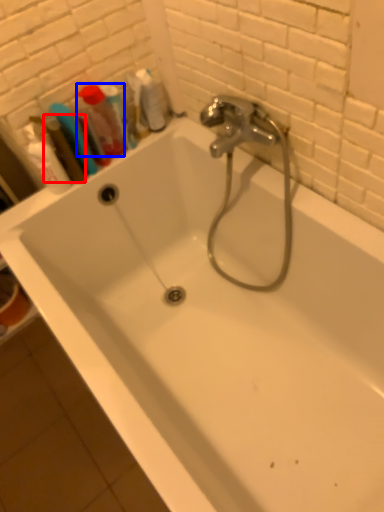
Question: Which object appears farthest to the camera in this image, mouthwash (highlighted by a red box) or mouthwash (highlighted by a blue box)?

Choices:
 (A) mouthwash
 (B) mouthwash

Answer: (B)